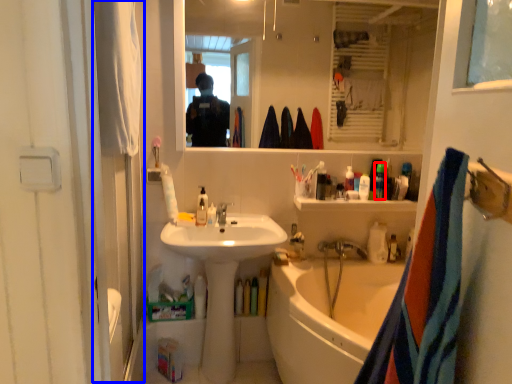
Question: Which object appears closest to the camera in this image, toiletry (highlighted by a red box) or screen door (highlighted by a blue box)?

Choices:
 (A) toiletry
 (B) screen door

Answer: (B)